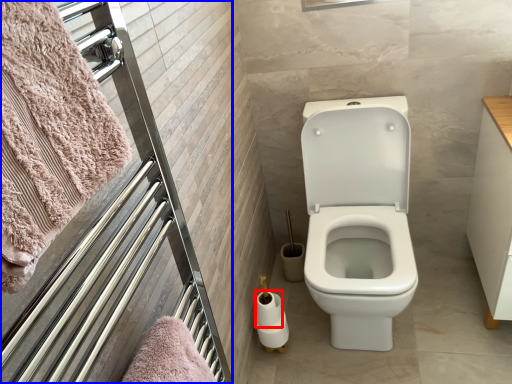
Question: Among these objects, which one is nearest to the camera, toilet paper (highlighted by a red box) or screen door (highlighted by a blue box)?

Choices:
 (A) toilet paper
 (B) screen door

Answer: (B)